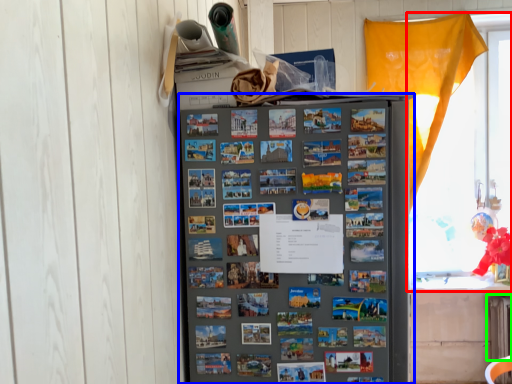
Question: Which is farther away from window (highlighted by a red box)? refrigerator (highlighted by a blue box) or radiator (highlighted by a green box)?

Choices:
 (A) refrigerator
 (B) radiator

Answer: (A)